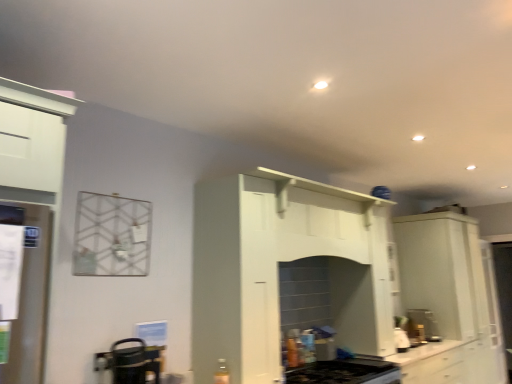
Question: Based on their positions, is white glossy cabinet at right located to the left or right of black plastic coffee machine at lower right?

Choices:
 (A) right
 (B) left

Answer: (A)

Question: From a real-world perspective, is white glossy cabinet at right above or below black plastic coffee machine at lower right?

Choices:
 (A) below
 (B) above

Answer: (B)

Question: Based on their relative distances, which object is farther from the black glass gas stove at lower center?

Choices:
 (A) white glossy cabinet at right
 (B) metallic silver kettle at lower left, the 1th appliance viewed from the back
 (C) white glossy refrigerator at left, positioned as the second appliance in bottom-to-top order
 (D) black plastic coffee machine at lower right
 (E) white glossy countertop at lower center

Answer: (C)

Question: Considering the real-world distances, which object is farthest from the white glossy cabinet at right?

Choices:
 (A) metallic silver kettle at lower left, which appears as the second appliance when viewed from the left
 (B) black plastic coffee machine at lower right
 (C) white glossy countertop at lower center
 (D) black glass gas stove at lower center
 (E) white glossy refrigerator at left, which appears as the second appliance when viewed from the back

Answer: (E)